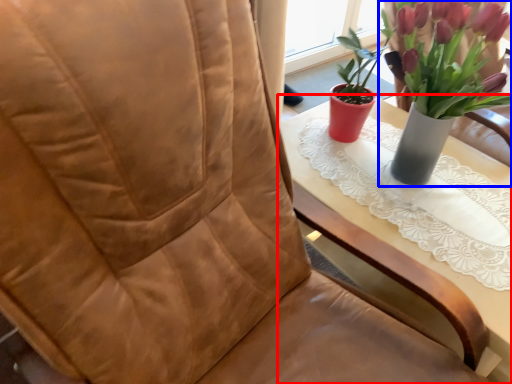
Question: Among these objects, which one is nearest to the camera, table (highlighted by a red box) or houseplant (highlighted by a blue box)?

Choices:
 (A) table
 (B) houseplant

Answer: (B)